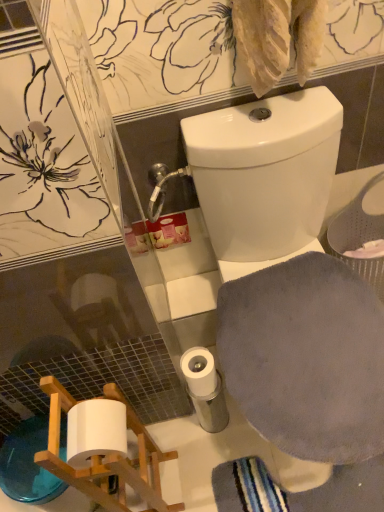
Question: In the image, is white matte toilet paper at lower center on the left side or the right side of white glossy toilet at upper center?

Choices:
 (A) left
 (B) right

Answer: (A)

Question: From a real-world perspective, is white matte toilet paper at lower center positioned above or below white glossy toilet at upper center?

Choices:
 (A) below
 (B) above

Answer: (A)

Question: Based on their relative distances, which object is farther from the gray soft cloth at lower right?

Choices:
 (A) white glossy toilet at upper center
 (B) white matte toilet paper at lower center

Answer: (B)

Question: Estimate the real-world distances between objects in this image. Which object is farther from the white glossy toilet at upper center?

Choices:
 (A) gray soft cloth at lower right
 (B) white matte toilet paper at lower center

Answer: (B)